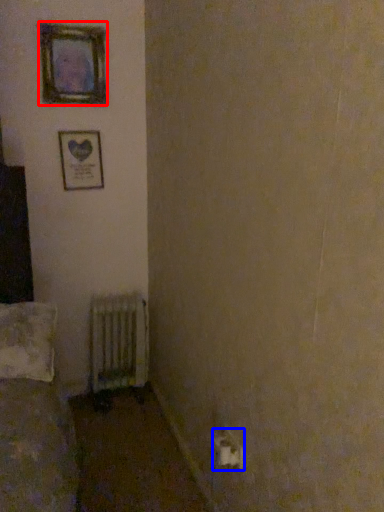
Question: Which object is closer to the camera taking this photo, picture frame (highlighted by a red box) or electric outlet (highlighted by a blue box)?

Choices:
 (A) picture frame
 (B) electric outlet

Answer: (B)